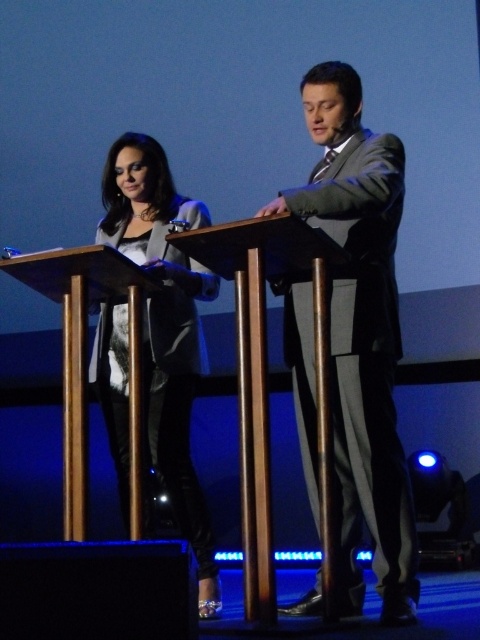
You are a photographer positioned behind the two speakers. You want to capture a closeup shot of both the matte gray suit at center and the matte black jacket at center in the same frame. Given that your camera has a 50mm lens with a depth of field that can sharply focus on objects within a 20 inch range, will both items be in focus simultaneously?

The matte gray suit at center is 21.49 inches away from the matte black jacket at center. Since the depth of field can only sharply focus within a 20 inch range, the distance between them exceeds this limit. Therefore, both items cannot be in focus simultaneously with the current settings.

What is the 2D coordinate of the matte gray suit at center?

The matte gray suit at center is located at the 2D coordinate point of (361,332).